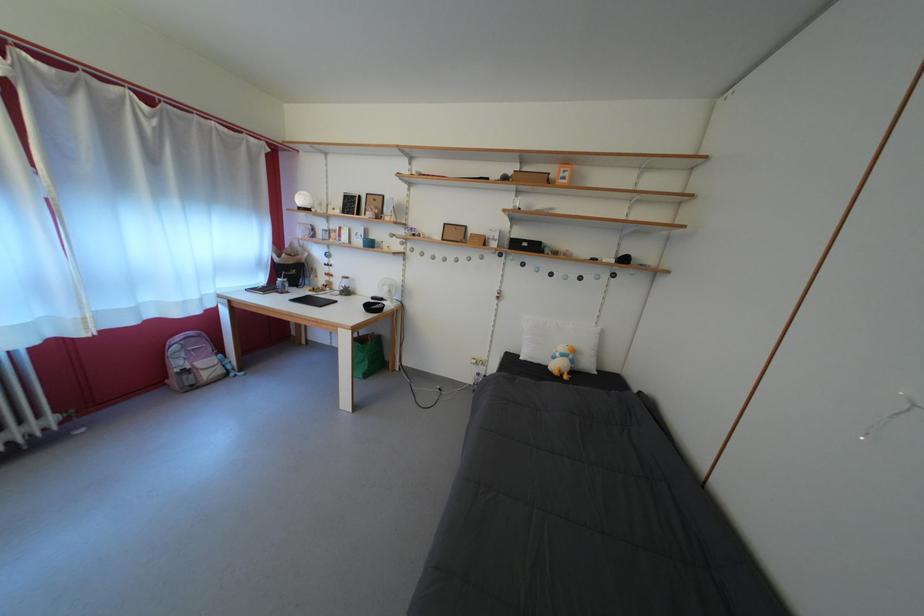
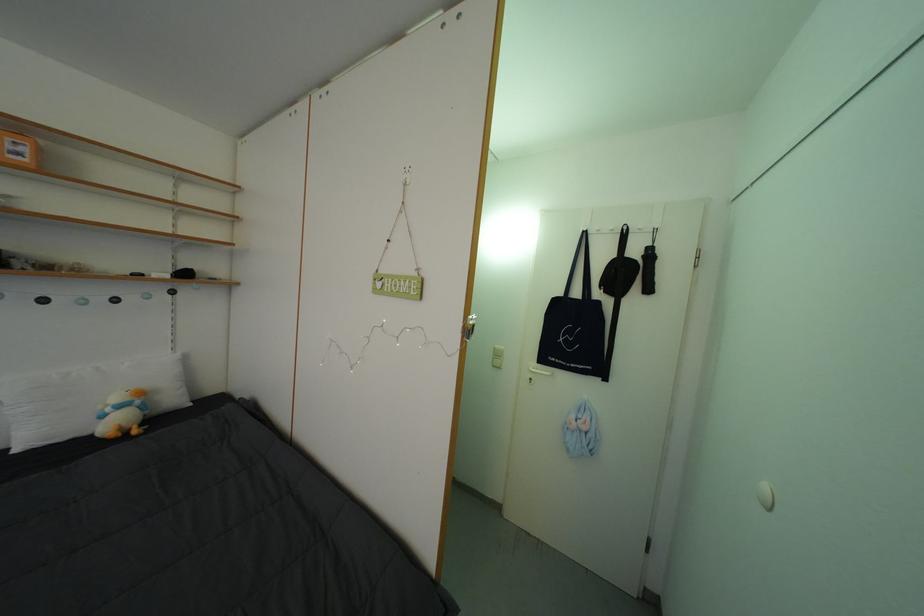
The point at [580,368] is marked in the first image. Where is the corresponding point in the second image?

(152, 413)